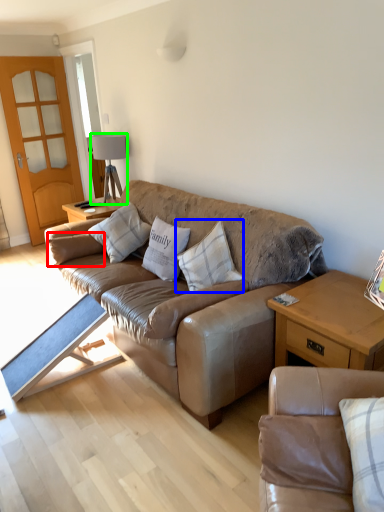
Question: Considering the real-world distances, which object is closest to pillow (highlighted by a red box)? pillow (highlighted by a blue box) or lamp (highlighted by a green box).

Choices:
 (A) pillow
 (B) lamp

Answer: (B)